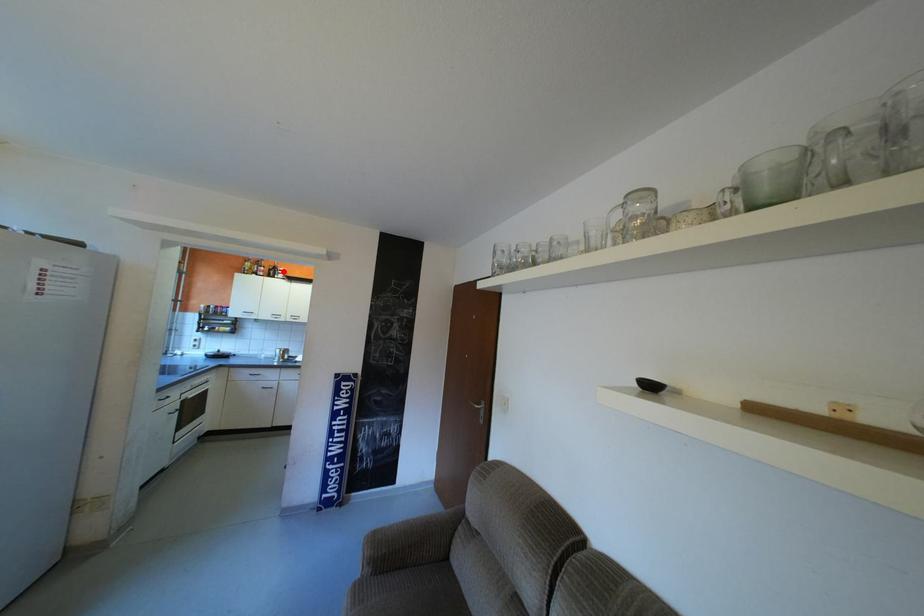
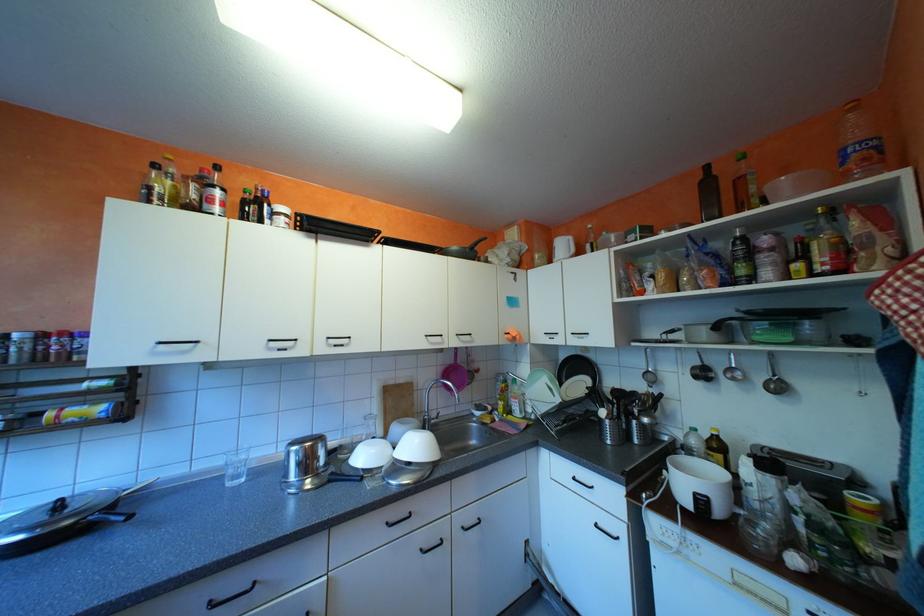
Find the pixel in the second image that matches the highlighted location in the first image.

(263, 208)